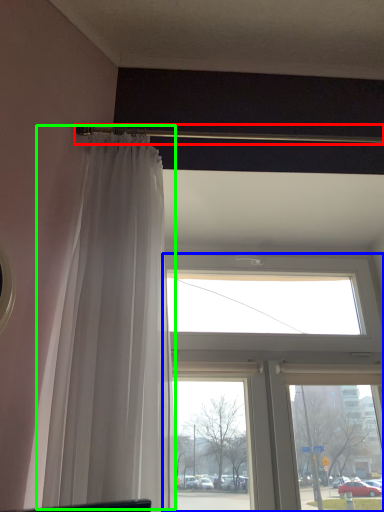
Question: Which object is the closest to the beam (highlighted by a red box)? Choose among these: window (highlighted by a blue box) or curtain (highlighted by a green box).

Choices:
 (A) window
 (B) curtain

Answer: (B)